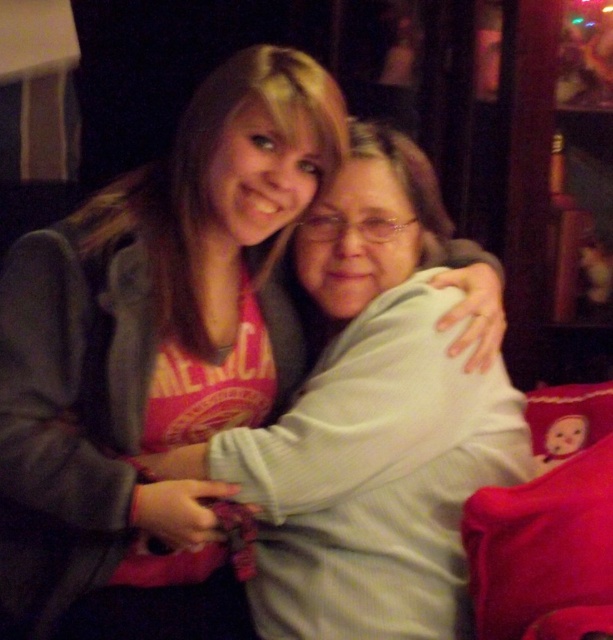
Consider the image. You are designing a seating arrangement for a cozy living room. You have two pillows, the red plush pillow at lower right and the velvet plush pillow at upper right. Which pillow should you choose if you want a larger one to provide better back support?

The red plush pillow at lower right is larger than the velvet plush pillow at upper right, so it would provide better back support.

You are an interior designer assessing the placement of furniture in a living room. You notice a couch with two people sitting on it. There is a point labeled at coordinates (544, 552). Based on the scene description, what object does this point most likely represent?

The point at coordinates (544, 552) most likely represents the red plush pillow at lower right.

You are designing a seating arrangement for a cozy living room. You have two pillows, the red plush pillow at lower right and the velvet plush pillow at upper right. Which pillow is taller?

The red plush pillow at lower right is much taller than the velvet plush pillow at upper right.